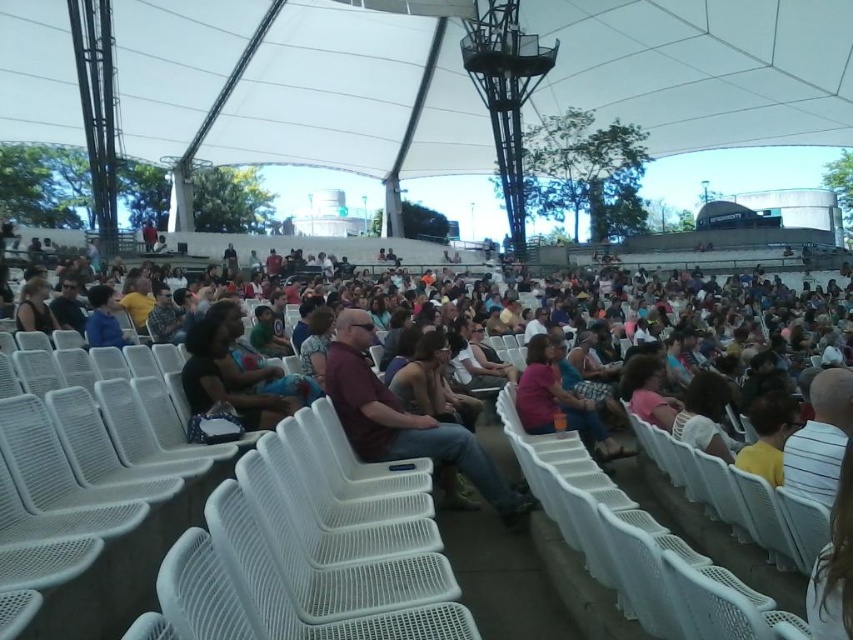
How far apart are maroon fabric shirt at center and matte black shirt at center?

maroon fabric shirt at center is 17.17 meters away from matte black shirt at center.

Between maroon fabric shirt at center and matte black shirt at center, which one has more height?

maroon fabric shirt at center is taller.

Does point (360, 406) come behind point (57, 312)?

No, (360, 406) is closer to viewer.

This screenshot has height=640, width=853. In order to click on maroon fabric shirt at center in this screenshot , I will do [x=405, y=420].

Which is in front, point (207, 349) or point (68, 317)?

Point (207, 349) is in front.

Measure the distance between point (270, 422) and camera.

Point (270, 422) is 22.02 meters from camera.

I want to click on dark blue fabric shirt at center, so click(224, 380).

Is pink fabric shirt at center above matte blue shirt at center?

Incorrect, pink fabric shirt at center is not positioned above matte blue shirt at center.

Is pink fabric shirt at center thinner than matte blue shirt at center?

Correct, pink fabric shirt at center's width is less than matte blue shirt at center's.

Is point (529, 403) less distant than point (96, 301)?

Yes, it is in front of point (96, 301).

Image resolution: width=853 pixels, height=640 pixels. Find the location of `pink fabric shirt at center`. pink fabric shirt at center is located at coordinates (558, 403).